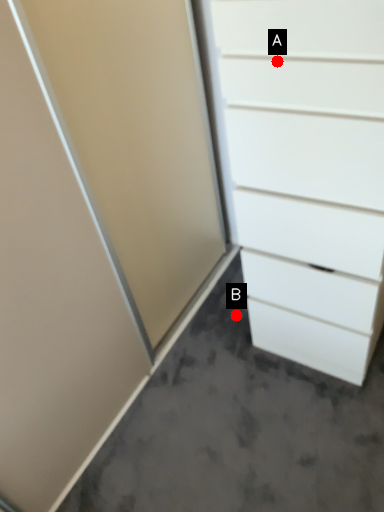
Question: Two points are circled on the image, labeled by A and B beside each circle. Which point is closer to the camera?

Choices:
 (A) A is closer
 (B) B is closer

Answer: (A)